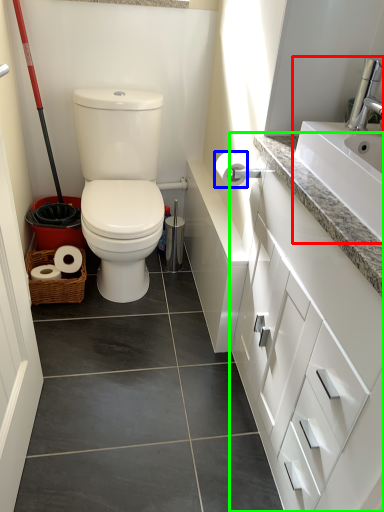
Question: Estimate the real-world distances between objects in this image. Which object is farther from sink (highlighted by a red box), toilet paper (highlighted by a blue box) or bathroom cabinet (highlighted by a green box)?

Choices:
 (A) toilet paper
 (B) bathroom cabinet

Answer: (A)